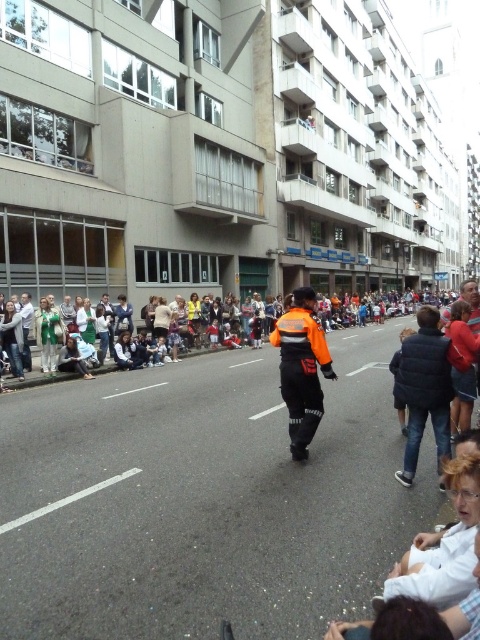
Question: Can you confirm if black puffer jacket at lower right is positioned to the right of orange fabric jacket at center?

Choices:
 (A) no
 (B) yes

Answer: (B)

Question: Which point is farther to the camera?

Choices:
 (A) (420, 420)
 (B) (310, 436)
 (C) (468, 316)

Answer: (C)

Question: Which point appears farthest from the camera in this image?

Choices:
 (A) (455, 406)
 (B) (325, 378)
 (C) (412, 392)

Answer: (A)

Question: Does black puffer jacket at lower right have a smaller size compared to orange reflective jacket at center?

Choices:
 (A) yes
 (B) no

Answer: (A)

Question: Is orange fabric jacket at center above orange reflective jacket at center?

Choices:
 (A) no
 (B) yes

Answer: (B)

Question: Which of the following is the closest to the observer?

Choices:
 (A) (302, 301)
 (B) (422, 420)

Answer: (B)